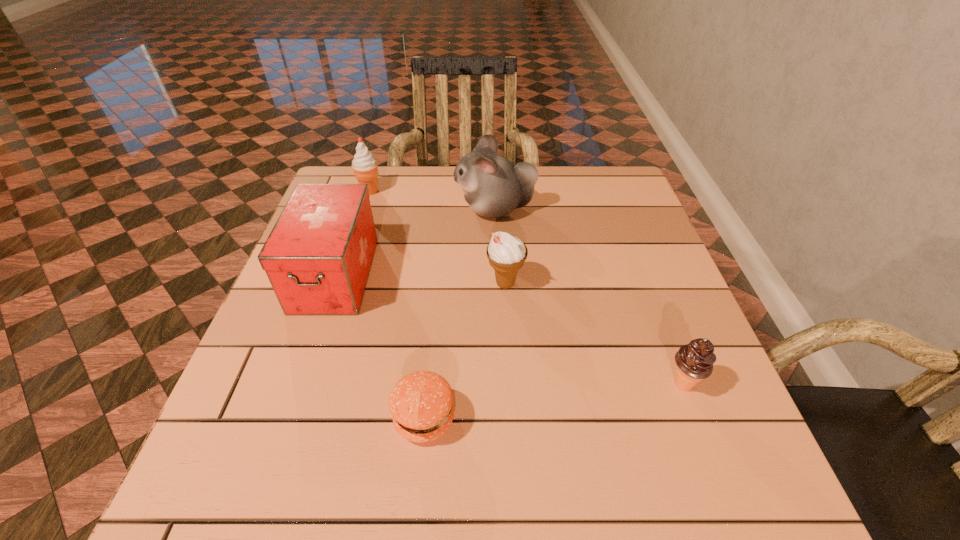
The image size is (960, 540). What are the coordinates of `object that is at the far left corner` in the screenshot? It's located at (364, 165).

In order to click on vacant space at the far edge in this screenshot , I will do `click(440, 188)`.

Find the location of a particular element. free region at the left edge of the desktop is located at coordinates (306, 453).

Locate an element on the screen. The image size is (960, 540). blank space at the right edge is located at coordinates (650, 349).

Identify the location of vacant point at the far right corner. (572, 167).

I want to click on free space between the leftmost icecream and the hamster, so click(x=432, y=200).

Identify the location of vacant space that's between the hamster and the first-aid kit. Image resolution: width=960 pixels, height=540 pixels. (415, 242).

The image size is (960, 540). I want to click on free space between the farthest icecream and the patty, so click(397, 305).

At what (x,y) coordinates should I click in order to perform the action: click on vacant space that's between the first-aid kit and the rightmost icecream. Please return your answer as a coordinate pair (x, y). Looking at the image, I should click on (509, 329).

Find the location of a particular element. vacant space that's between the leftmost icecream and the hamster is located at coordinates click(432, 200).